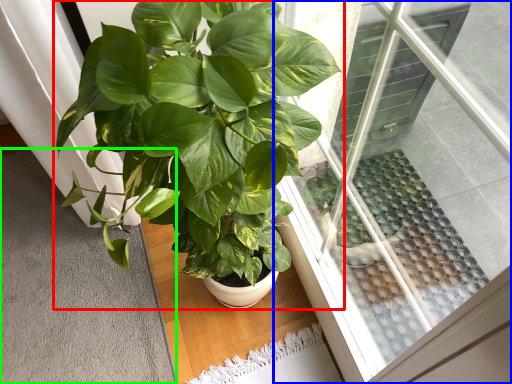
Question: Based on their relative distances, which object is nearer to houseplant (highlighted by a red box)? Choose from window (highlighted by a blue box) and gray (highlighted by a green box).

Choices:
 (A) window
 (B) gray

Answer: (A)